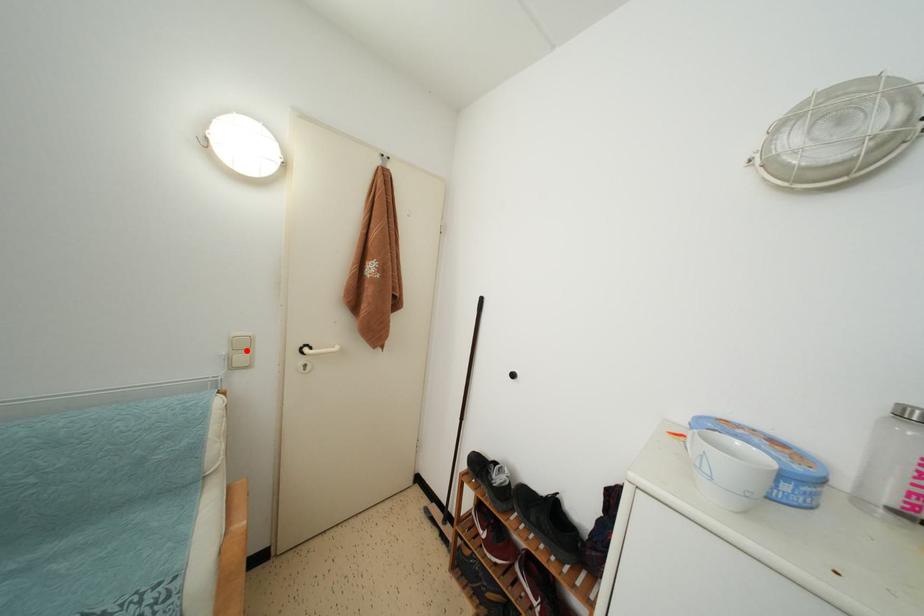
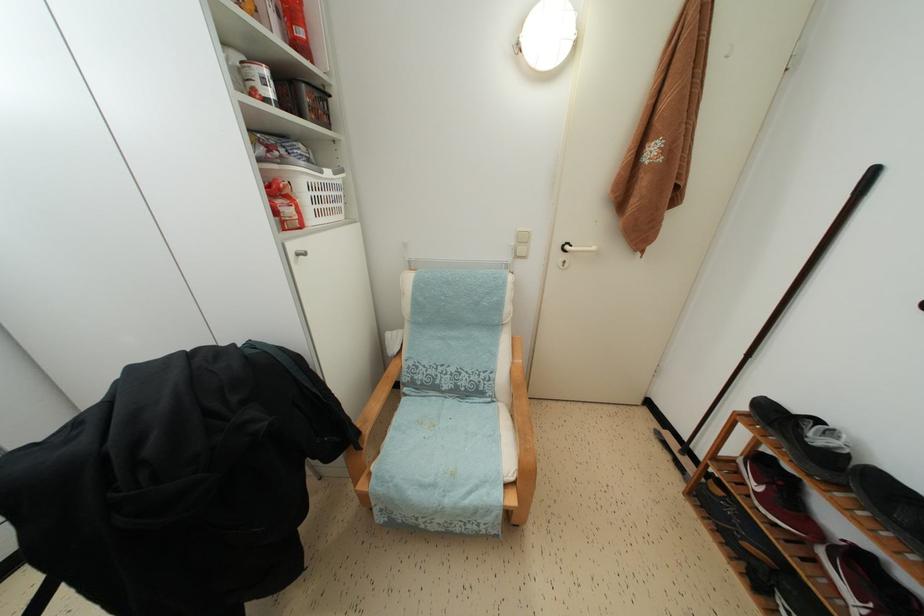
Where in the second image is the point corresponding to the highlighted location from the first image?

(527, 245)